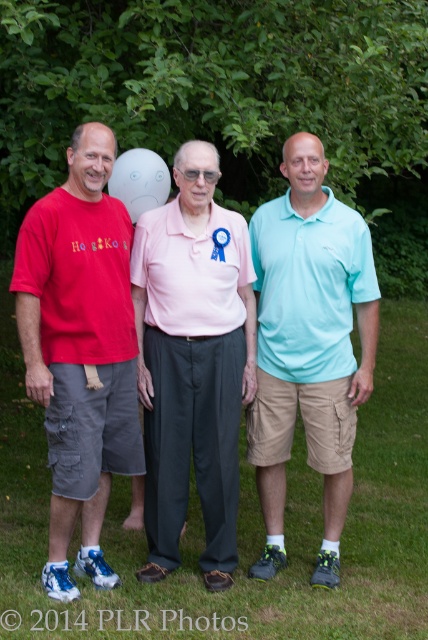
Can you confirm if matte red t-shirt at left is taller than white matte balloon at center?

Yes.

Is matte red t-shirt at left to the right of white matte balloon at center from the viewer's perspective?

In fact, matte red t-shirt at left is to the left of white matte balloon at center.

Who is more forward, (53, 432) or (160, 180)?

Point (53, 432) is more forward.

I want to click on matte red t-shirt at left, so click(80, 353).

Between matte red t-shirt at left and light blue cotton polo shirt at center, which one has less height?

matte red t-shirt at left is shorter.

Which is behind, point (53, 378) or point (341, 260)?

The point (341, 260) is behind.

Who is more distant from viewer, (83, 268) or (323, 440)?

Point (323, 440)

Find the location of `matte red t-shirt at left`. matte red t-shirt at left is located at coordinates (80, 353).

Does matte red t-shirt at left have a greater height compared to pink fabric shirt at center?

Correct, matte red t-shirt at left is much taller as pink fabric shirt at center.

Is matte red t-shirt at left thinner than pink fabric shirt at center?

Correct, matte red t-shirt at left's width is less than pink fabric shirt at center's.

At what (x,y) coordinates should I click in order to perform the action: click on matte red t-shirt at left. Please return your answer as a coordinate pair (x, y). The image size is (428, 640). Looking at the image, I should click on (80, 353).